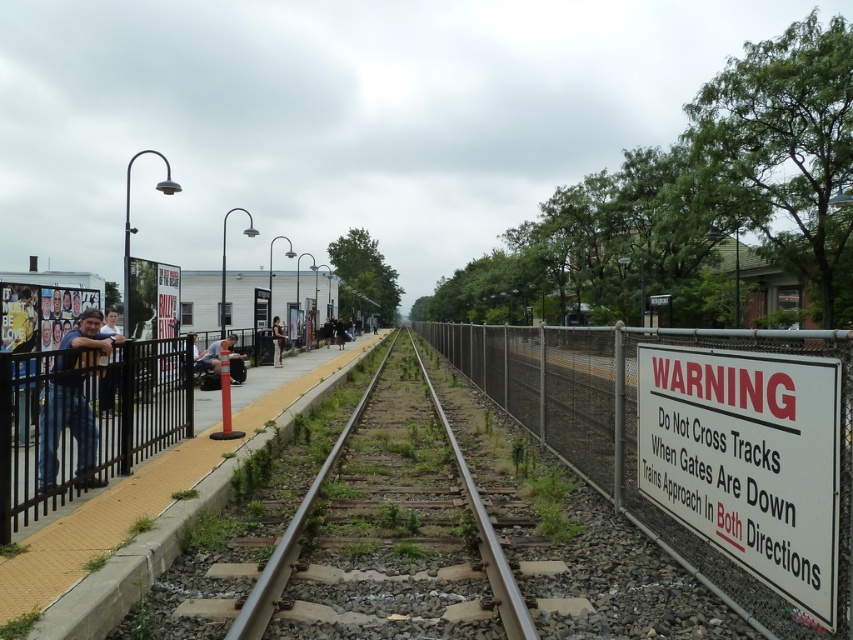
You are a photographer standing on the platform at the railway station. You want to take a photo of both the warning sign and the yellow tactile paving strip. The warning sign is located at point (587, 460) and the yellow tactile paving strip is at point (111, 369). Which point should you focus on first if you want to ensure both are in the frame without moving the camera?

You should focus on point (587, 460) first because it is further away from the camera than point (111, 369). By focusing on the farther point, both points will be in focus due to the depth of field.

You are a pedestrian on the platform and need to reach the dark blue jeans at left without stepping onto the smooth metal train track at center. How should you navigate around it?

The smooth metal train track at center is on the right side of the dark blue jeans at left, so you should move to the left of the dark blue jeans at left to avoid stepping onto the track.